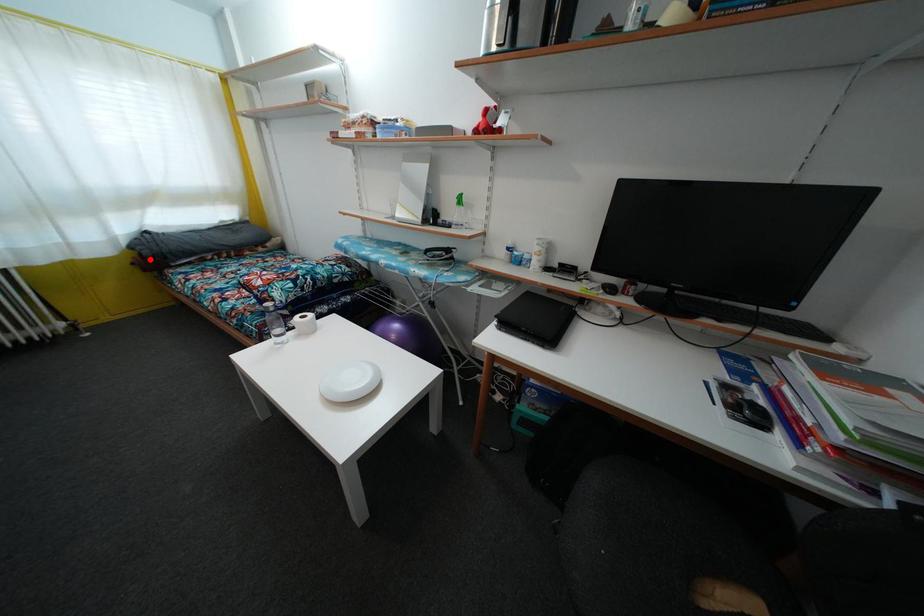
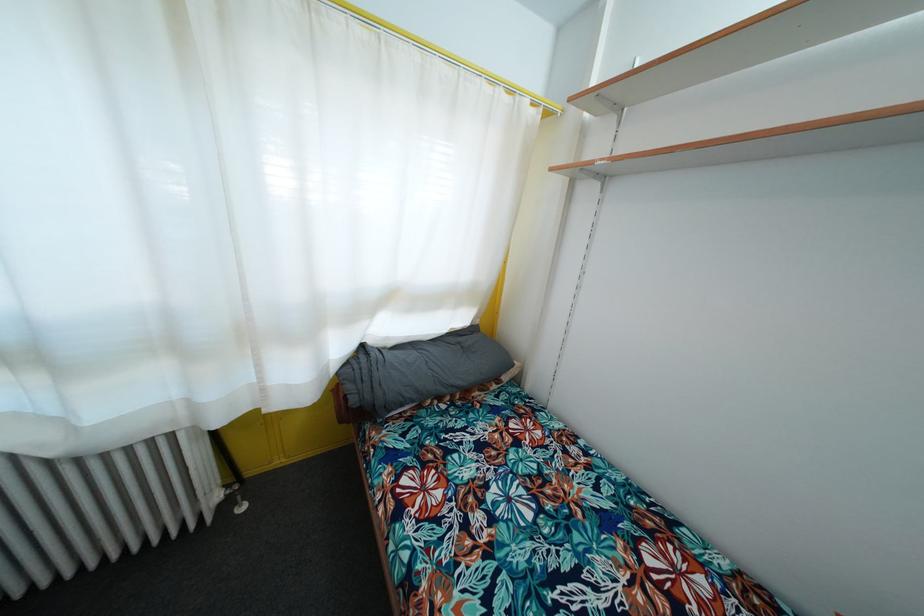
Question: A red point is marked in image1. In image2, is the corresponding 3D point closer to the camera or farther? Reply with the corresponding letter.

Choices:
 (A) The corresponding 3D point is closer.
 (B) The corresponding 3D point is farther.

Answer: (B)